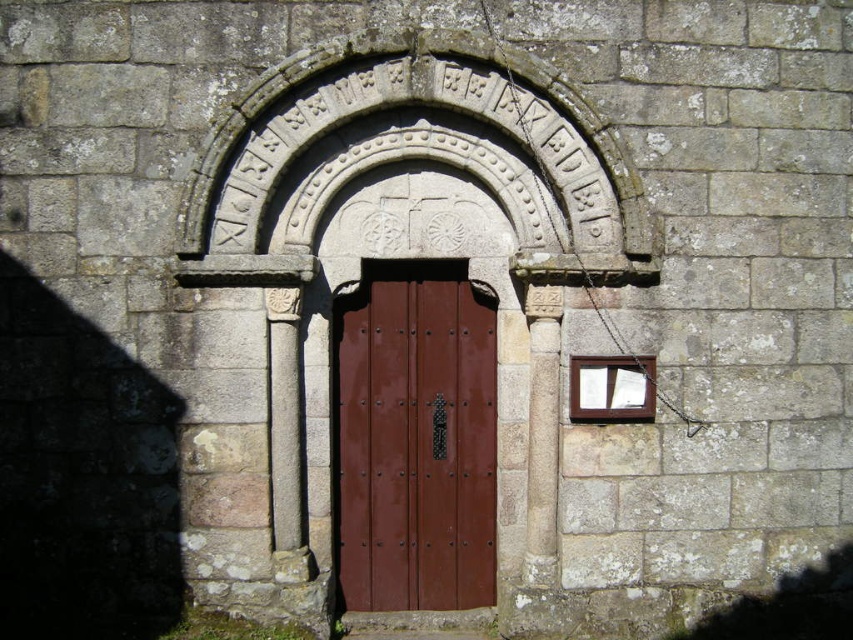
Question: From the image, what is the correct spatial relationship of carved stone arch at center in relation to brown polished wood door at center?

Choices:
 (A) right
 (B) left

Answer: (A)

Question: Which point is farther to the camera?

Choices:
 (A) carved stone arch at center
 (B) wooden window at right

Answer: (B)

Question: Based on their relative distances, which object is farther from the brown polished wood door at center?

Choices:
 (A) carved stone arch at center
 (B) wooden window at right

Answer: (A)

Question: Which point is farther to the camera?

Choices:
 (A) brown polished wood door at center
 (B) wooden window at right
 (C) carved stone arch at center

Answer: (A)

Question: Is brown polished wood door at center smaller than wooden window at right?

Choices:
 (A) yes
 (B) no

Answer: (B)

Question: Is carved stone arch at center above wooden window at right?

Choices:
 (A) yes
 (B) no

Answer: (A)